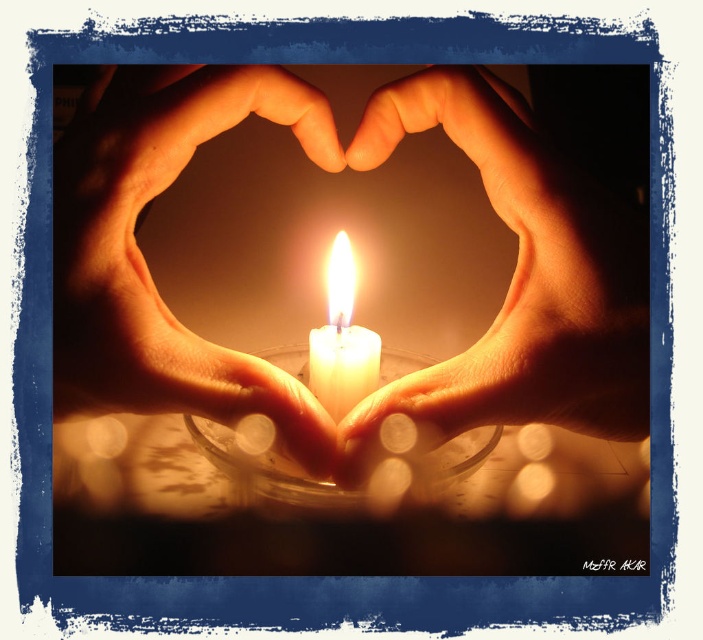
Question: Is matte skin hand at center above matte skin hands at center?

Choices:
 (A) yes
 (B) no

Answer: (B)

Question: Which object is closer to the camera taking this photo?

Choices:
 (A) matte skin hand at center
 (B) matte skin hands at center

Answer: (B)

Question: Which of the following is the closest to the observer?

Choices:
 (A) pos(347,275)
 (B) pos(108,291)

Answer: (B)

Question: Among these objects, which one is nearest to the camera?

Choices:
 (A) matte skin hands at center
 (B) white wax candle at center
 (C) matte skin hand at center

Answer: (A)

Question: Can you confirm if matte skin hand at center is bigger than matte skin hands at center?

Choices:
 (A) yes
 (B) no

Answer: (B)

Question: Is matte skin hand at center positioned behind matte skin hands at center?

Choices:
 (A) yes
 (B) no

Answer: (A)